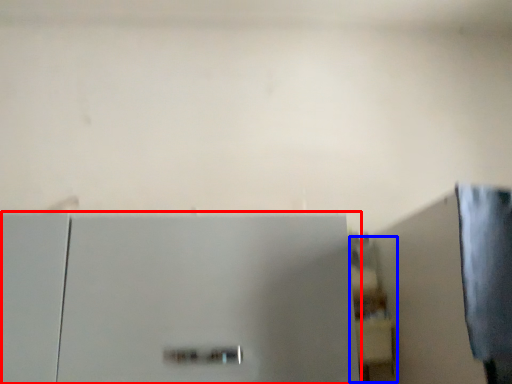
Question: Which of the following is the farthest to the observer, refrigerator (highlighted by a red box) or shelf (highlighted by a blue box)?

Choices:
 (A) refrigerator
 (B) shelf

Answer: (B)